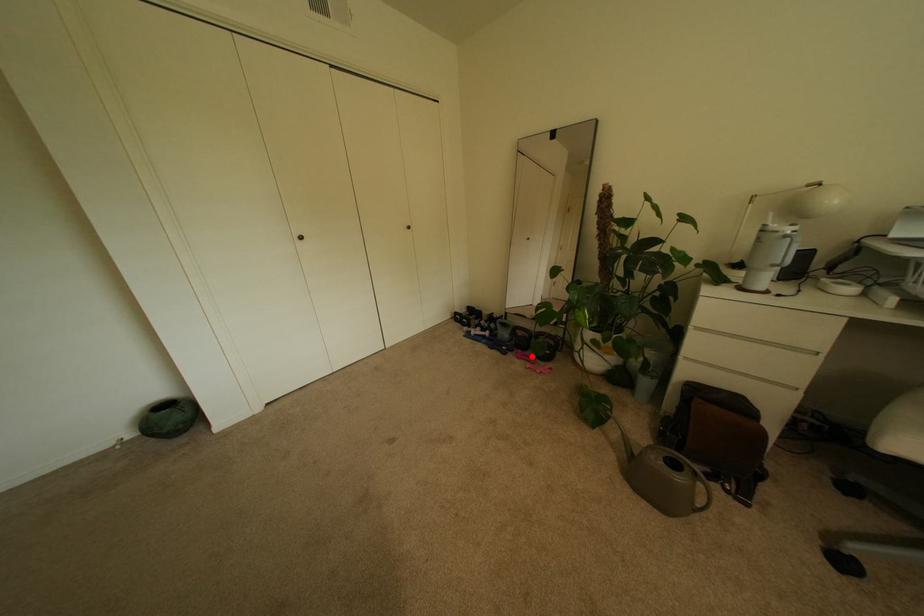
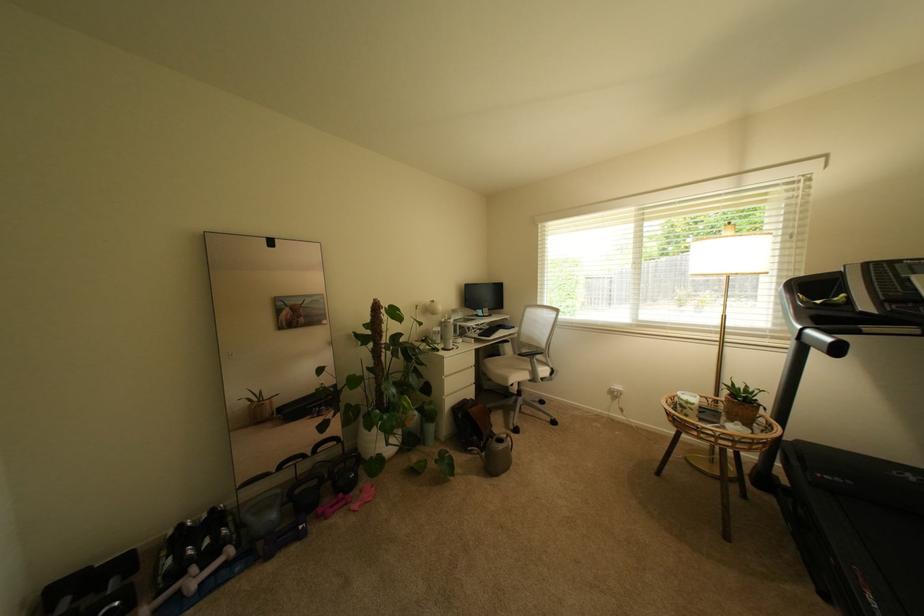
In the second image, find the point that corresponds to the highlighted location in the first image.

(339, 508)